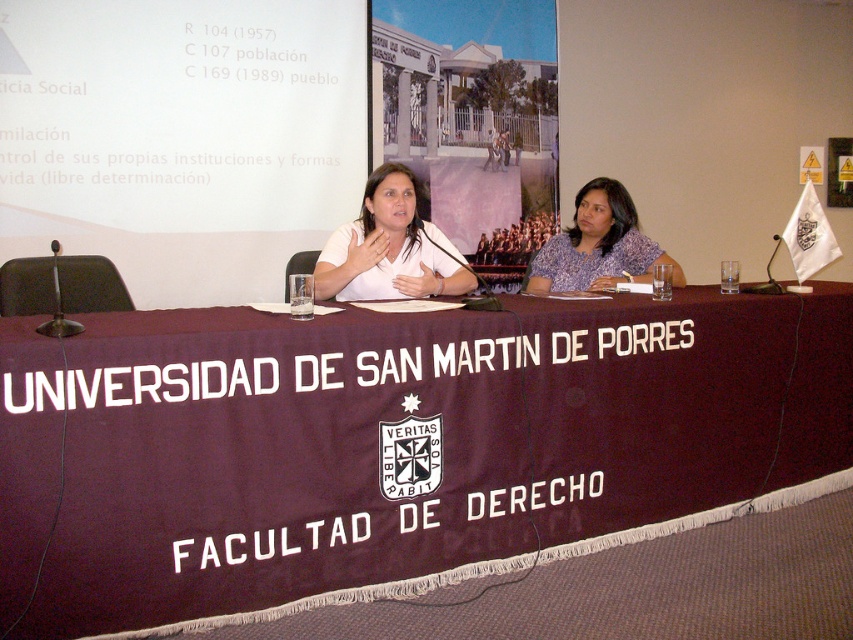
Which of these two, white matte shirt at center or purple printed blouse at center, stands taller?

With more height is white matte shirt at center.

Does white matte shirt at center have a greater width compared to purple printed blouse at center?

No.

This screenshot has height=640, width=853. I want to click on white matte shirt at center, so click(x=389, y=248).

Does maroon fabric table at center have a larger size compared to purple printed blouse at center?

Indeed, maroon fabric table at center has a larger size compared to purple printed blouse at center.

Is maroon fabric table at center to the left of purple printed blouse at center from the viewer's perspective?

Correct, you'll find maroon fabric table at center to the left of purple printed blouse at center.

The width and height of the screenshot is (853, 640). What do you see at coordinates (392, 445) in the screenshot?
I see `maroon fabric table at center` at bounding box center [392, 445].

This screenshot has width=853, height=640. Find the location of `maroon fabric table at center`. maroon fabric table at center is located at coordinates (392, 445).

Is the position of maroon fabric table at center less distant than that of white matte shirt at center?

Yes, it is.

Based on the photo, who is higher up, maroon fabric table at center or white matte shirt at center?

white matte shirt at center is higher up.

Locate an element on the screen. maroon fabric table at center is located at coordinates (392, 445).